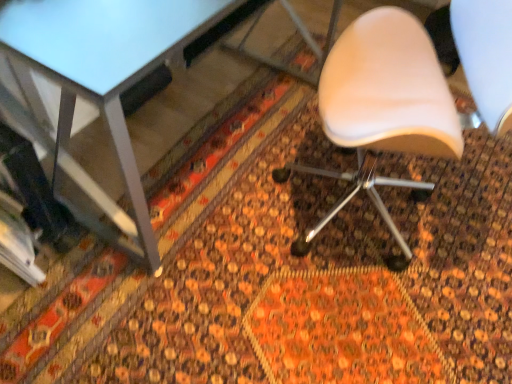
Question: In terms of size, does white leather chair at center appear bigger or smaller than metallic gray table at upper left?

Choices:
 (A) big
 (B) small

Answer: (B)

Question: From the image's perspective, is white leather chair at center positioned above or below metallic gray table at upper left?

Choices:
 (A) above
 (B) below

Answer: (B)

Question: Is white leather chair at center in front of or behind metallic gray table at upper left in the image?

Choices:
 (A) front
 (B) behind

Answer: (A)

Question: Relative to white leather chair at center, is metallic gray table at upper left in front or behind?

Choices:
 (A) behind
 (B) front

Answer: (A)

Question: Does point (32, 18) appear closer or farther from the camera than point (459, 148)?

Choices:
 (A) closer
 (B) farther

Answer: (A)

Question: Is metallic gray table at upper left spatially inside white leather chair at center, or outside of it?

Choices:
 (A) outside
 (B) inside

Answer: (A)

Question: Looking at the image, does metallic gray table at upper left seem bigger or smaller compared to white leather chair at center?

Choices:
 (A) big
 (B) small

Answer: (A)